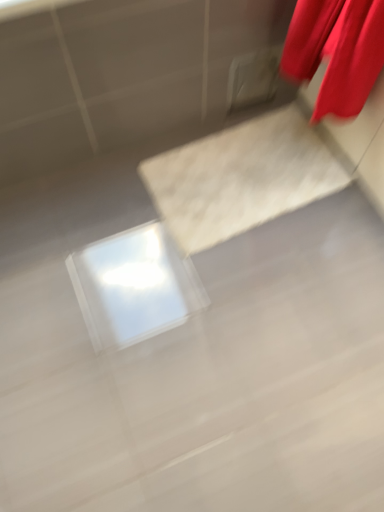
Question: Can you confirm if white glossy concrete at center is shorter than red satin curtain at upper right?

Choices:
 (A) yes
 (B) no

Answer: (A)

Question: Does white glossy concrete at center lie in front of red satin curtain at upper right?

Choices:
 (A) yes
 (B) no

Answer: (B)

Question: Is white glossy concrete at center to the right of red satin curtain at upper right from the viewer's perspective?

Choices:
 (A) yes
 (B) no

Answer: (B)

Question: Could you tell me if white glossy concrete at center is facing red satin curtain at upper right?

Choices:
 (A) yes
 (B) no

Answer: (B)

Question: Is white glossy concrete at center next to red satin curtain at upper right?

Choices:
 (A) no
 (B) yes

Answer: (A)

Question: From the image's perspective, does white glossy concrete at center appear lower than red satin curtain at upper right?

Choices:
 (A) yes
 (B) no

Answer: (A)

Question: Is red satin curtain at upper right oriented towards white glossy concrete at center?

Choices:
 (A) yes
 (B) no

Answer: (B)

Question: From the image's perspective, is red satin curtain at upper right under white glossy concrete at center?

Choices:
 (A) no
 (B) yes

Answer: (A)

Question: Can you confirm if red satin curtain at upper right is shorter than white glossy concrete at center?

Choices:
 (A) yes
 (B) no

Answer: (B)

Question: Is red satin curtain at upper right touching white glossy concrete at center?

Choices:
 (A) no
 (B) yes

Answer: (A)

Question: Considering the relative positions of red satin curtain at upper right and white glossy concrete at center in the image provided, is red satin curtain at upper right to the right of white glossy concrete at center from the viewer's perspective?

Choices:
 (A) no
 (B) yes

Answer: (B)

Question: Is red satin curtain at upper right positioned behind white glossy concrete at center?

Choices:
 (A) yes
 (B) no

Answer: (B)

Question: Relative to white glossy concrete at center, is red satin curtain at upper right in front or behind?

Choices:
 (A) behind
 (B) front

Answer: (B)